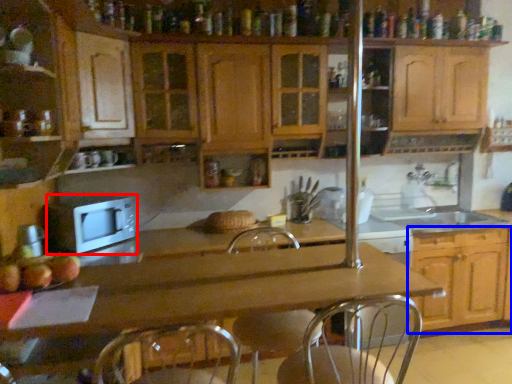
Question: Which object is closer to the camera taking this photo, microwave oven (highlighted by a red box) or cabinetry (highlighted by a blue box)?

Choices:
 (A) microwave oven
 (B) cabinetry

Answer: (A)